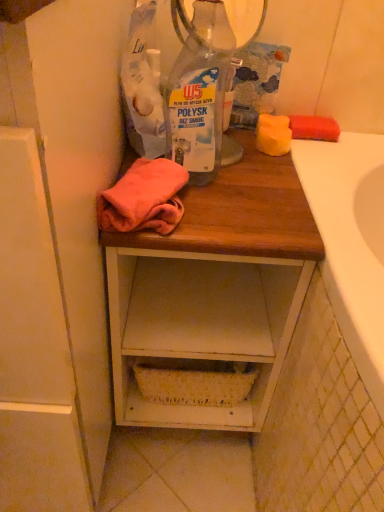
Question: From the image's perspective, is wooden desk at center located above or below transparent plastic bottle at center?

Choices:
 (A) above
 (B) below

Answer: (B)

Question: Looking at the image, does wooden desk at center seem bigger or smaller compared to transparent plastic bottle at center?

Choices:
 (A) small
 (B) big

Answer: (B)

Question: Considering the real-world distances, which object is closest to the wooden desk at center?

Choices:
 (A) white wood cabinet at left
 (B) transparent plastic bottle at center

Answer: (A)

Question: Which of these objects is positioned farthest from the transparent plastic bottle at center?

Choices:
 (A) wooden desk at center
 (B) white wood cabinet at left

Answer: (B)